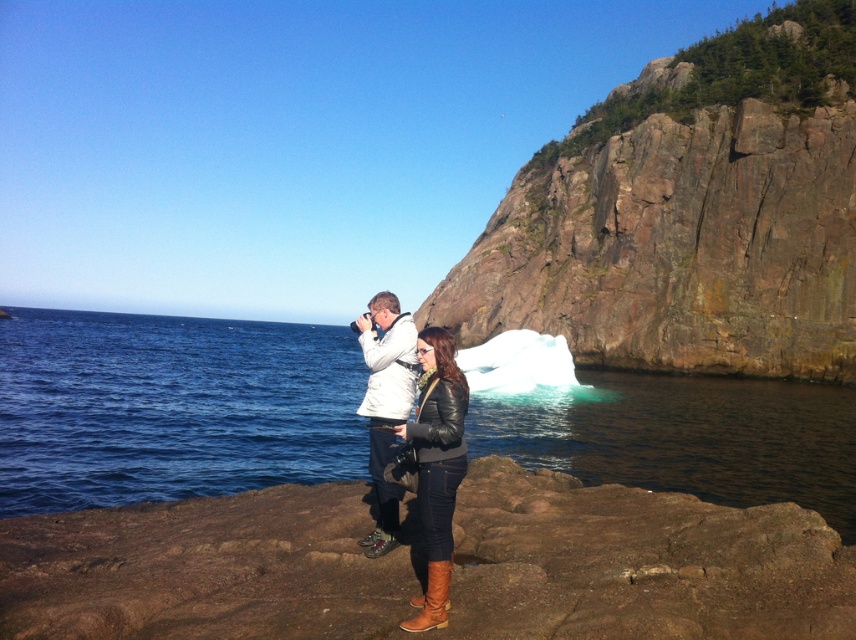
Question: Observing the image, what is the correct spatial positioning of rugged stone cliff at upper right in reference to clear blue water at center?

Choices:
 (A) right
 (B) left

Answer: (A)

Question: Considering the relative positions of rugged stone cliff at upper right and white matte jacket at center in the image provided, where is rugged stone cliff at upper right located with respect to white matte jacket at center?

Choices:
 (A) right
 (B) left

Answer: (A)

Question: Considering the relative positions of brown rock at center and clear blue water at center in the image provided, where is brown rock at center located with respect to clear blue water at center?

Choices:
 (A) left
 (B) right

Answer: (B)

Question: Which object is the closest to the white matte jacket at center?

Choices:
 (A) rugged stone cliff at upper right
 (B) brown rock at center
 (C) clear blue water at center
 (D) brown leather jacket at center

Answer: (D)

Question: Which point is closer to the camera?

Choices:
 (A) (639, 600)
 (B) (795, 141)
 (C) (749, 484)

Answer: (A)

Question: Which point is closer to the camera?

Choices:
 (A) white matte jacket at center
 (B) rugged stone cliff at upper right
 (C) brown leather jacket at center

Answer: (C)